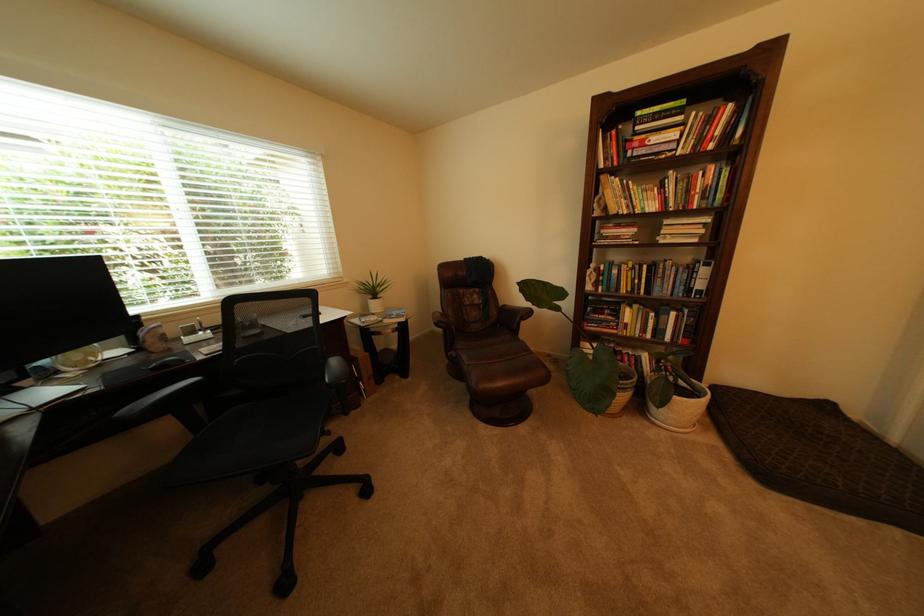
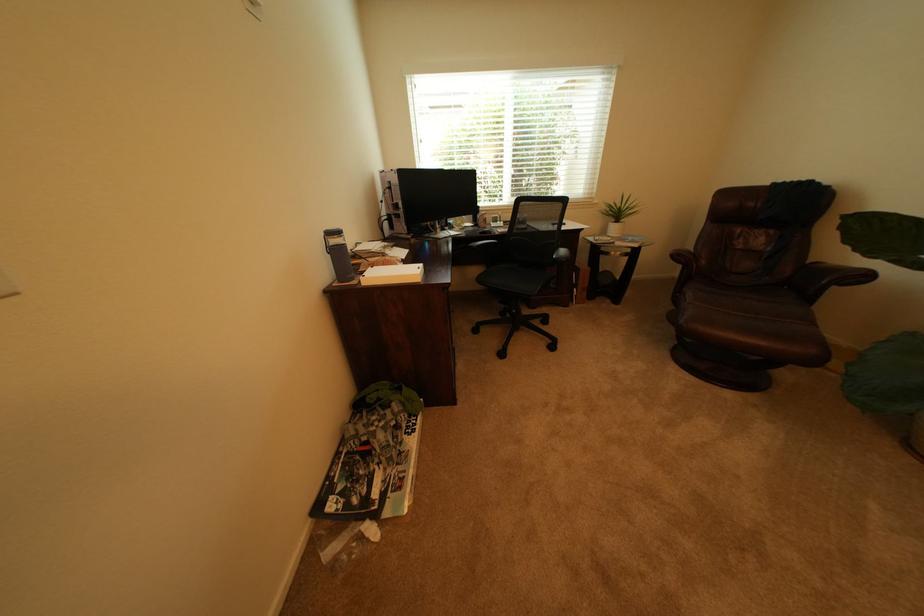
In the second image, find the point that corresponds to the point at 512,307 in the first image.

(821, 262)